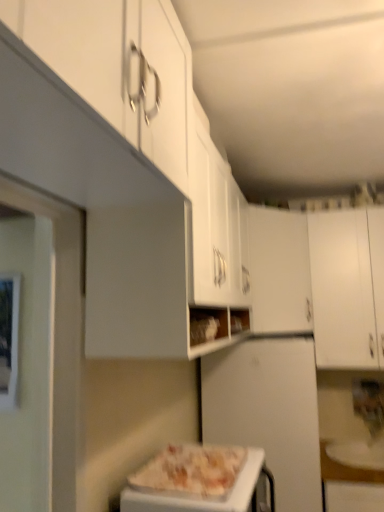
Image resolution: width=384 pixels, height=512 pixels. Describe the element at coordinates (348, 288) in the screenshot. I see `white matte cabinet at right, the first cabinetry viewed from the right` at that location.

Find the location of a particular element. This screenshot has height=512, width=384. white glossy plate at lower right is located at coordinates (346, 470).

What do you see at coordinates (346, 470) in the screenshot?
I see `white glossy plate at lower right` at bounding box center [346, 470].

You are a GUI agent. You are given a task and a screenshot of the screen. Output one action in this format:
    pyautogui.click(x=<x>, y=<y>)
    Task: Click on the white glossy pizza at center
    
    Given the screenshot: What is the action you would take?
    click(191, 471)

This screenshot has width=384, height=512. Identify the location of cabinetry below the white matte cabinet at center, arranged as the first cabinetry when viewed from the left (from the image's perspective). (348, 288).

Is white matte cabinet at center, arranged as the first cabinetry when viewed from the left, with white matte cabinet at right, the second cabinetry from the left?

white matte cabinet at center, arranged as the first cabinetry when viewed from the left, is not next to white matte cabinet at right, the second cabinetry from the left, and they're not touching.

Can white matte cabinet at right, the second cabinetry from the left, be found inside white matte cabinet at center, arranged as the first cabinetry when viewed from the left?

No, white matte cabinet at right, the second cabinetry from the left, is not surrounded by white matte cabinet at center, arranged as the first cabinetry when viewed from the left.

Is white glossy plate at lower right wider than white matte refrigerator at center?

No.

Considering the positions of points (349, 470) and (252, 341), is point (349, 470) closer to camera compared to point (252, 341)?

That is False.

Considering the relative sizes of white glossy plate at lower right and white matte refrigerator at center in the image provided, is white glossy plate at lower right smaller than white matte refrigerator at center?

Indeed, white glossy plate at lower right has a smaller size compared to white matte refrigerator at center.

Can you see white matte cabinet at center, arranged as the first cabinetry when viewed from the left, touching white glossy pizza at center?

No, white matte cabinet at center, arranged as the first cabinetry when viewed from the left, is not touching white glossy pizza at center.

From the image's perspective, is white matte cabinet at center, arranged as the first cabinetry when viewed from the left, on white glossy pizza at center?

Indeed, from the image's perspective, white matte cabinet at center, arranged as the first cabinetry when viewed from the left, is shown above white glossy pizza at center.

Is white matte cabinet at center, acting as the second cabinetry starting from the right, inside or outside of white glossy pizza at center?

white matte cabinet at center, acting as the second cabinetry starting from the right, is outside white glossy pizza at center.

How far apart are white matte cabinet at center, acting as the second cabinetry starting from the right, and white glossy pizza at center?

They are 1.13 meters apart.

Is white matte cabinet at center, acting as the second cabinetry starting from the right, inside white glossy plate at lower right?

No, white matte cabinet at center, acting as the second cabinetry starting from the right, is not inside white glossy plate at lower right.

Is point (349, 478) less distant than point (261, 320)?

Yes, it is in front of point (261, 320).

Which of these two, white glossy plate at lower right or white matte cabinet at center, arranged as the first cabinetry when viewed from the left, is wider?

Wider between the two is white glossy plate at lower right.

You are a GUI agent. You are given a task and a screenshot of the screen. Output one action in this format:
    pyautogui.click(x=<x>, y=<y>)
    Task: Click on the appliance located on the left of white matte cabinet at center, acting as the second cabinetry starting from the right
    This screenshot has width=384, height=512.
    Given the screenshot: What is the action you would take?
    pyautogui.click(x=268, y=411)

How far apart are white matte refrigerator at center and white matte cabinet at center, arranged as the first cabinetry when viewed from the left?

They are 17.62 inches apart.

Would you say white matte refrigerator at center is inside or outside white matte cabinet at center, acting as the second cabinetry starting from the right?

white matte refrigerator at center is spatially situated outside white matte cabinet at center, acting as the second cabinetry starting from the right.

From a real-world perspective, who is located lower, white matte refrigerator at center or white matte cabinet at center, acting as the second cabinetry starting from the right?

From a 3D spatial view, white matte refrigerator at center is below.

Which is behind, white glossy pizza at center or white glossy plate at lower right?

white glossy plate at lower right is further from the camera.

Which object is positioned more to the left, white glossy pizza at center or white glossy plate at lower right?

white glossy pizza at center is more to the left.

Is white glossy pizza at center in contact with white glossy plate at lower right?

No.

The image size is (384, 512). I want to click on pizza lying on the left of white glossy plate at lower right, so click(x=191, y=471).

At what (x,y) coordinates should I click in order to perform the action: click on cabinetry that is the 1st one above the white glossy pizza at center (from a real-world perspective). Please return your answer as a coordinate pair (x, y). This screenshot has width=384, height=512. Looking at the image, I should click on (348, 288).

From a real-world perspective, who is located lower, white glossy pizza at center or white matte cabinet at right, the second cabinetry from the left?

white glossy pizza at center, from a real-world perspective.

Which of these two, white glossy pizza at center or white matte cabinet at right, the second cabinetry from the left, stands taller?

With more height is white matte cabinet at right, the second cabinetry from the left.

From the image's perspective, is white glossy pizza at center located beneath white matte cabinet at right, the second cabinetry from the left?

Yes, from the image's perspective, white glossy pizza at center is below white matte cabinet at right, the second cabinetry from the left.

The width and height of the screenshot is (384, 512). In order to click on cabinetry lying above the white matte cabinet at right, the first cabinetry viewed from the right (from the image's perspective) in this screenshot , I will do `click(279, 272)`.

Locate an element on the screen. The height and width of the screenshot is (512, 384). appliance positioned vertically above the white glossy plate at lower right (from a real-world perspective) is located at coordinates (268, 411).

Considering their positions, is white matte refrigerator at center positioned closer to white matte cabinet at right, the first cabinetry viewed from the right, than white matte cabinet at center, acting as the second cabinetry starting from the right?

Among the two, white matte cabinet at center, acting as the second cabinetry starting from the right, is located nearer to white matte cabinet at right, the first cabinetry viewed from the right.

Looking at the image, which one is located closer to white glossy pizza at center, white glossy plate at lower right or white matte cabinet at right, the second cabinetry from the left?

Among the two, white glossy plate at lower right is located nearer to white glossy pizza at center.

Based on their spatial positions, is white matte cabinet at right, the second cabinetry from the left, or white glossy pizza at center further from white matte refrigerator at center?

Based on the image, white glossy pizza at center appears to be further to white matte refrigerator at center.

Estimate the real-world distances between objects in this image. Which object is closer to white glossy plate at lower right, white matte refrigerator at center or white matte cabinet at right, the first cabinetry viewed from the right?

The object closer to white glossy plate at lower right is white matte refrigerator at center.

From the picture: When comparing their distances from white matte refrigerator at center, does white glossy pizza at center or white glossy plate at lower right seem further?

white glossy pizza at center.

Considering their positions, is white glossy pizza at center positioned further to white matte refrigerator at center than white matte cabinet at center, acting as the second cabinetry starting from the right?

Based on the image, white glossy pizza at center appears to be further to white matte refrigerator at center.

From the picture: When comparing their distances from white glossy plate at lower right, does white matte cabinet at center, acting as the second cabinetry starting from the right, or white matte cabinet at right, the first cabinetry viewed from the right, seem closer?

white matte cabinet at right, the first cabinetry viewed from the right, lies closer to white glossy plate at lower right than the other object.

Considering their positions, is white glossy pizza at center positioned closer to white matte cabinet at right, the first cabinetry viewed from the right, than white matte cabinet at center, acting as the second cabinetry starting from the right?

The object closer to white matte cabinet at right, the first cabinetry viewed from the right, is white matte cabinet at center, acting as the second cabinetry starting from the right.

What are the coordinates of `counter top positioned between white glossy pizza at center and white matte cabinet at right, the second cabinetry from the left, from near to far` in the screenshot? It's located at (346, 470).

You are a GUI agent. You are given a task and a screenshot of the screen. Output one action in this format:
    pyautogui.click(x=<x>, y=<y>)
    Task: Click on the cabinetry between white matte cabinet at center, arranged as the first cabinetry when viewed from the left, and white glossy plate at lower right, in the vertical direction
    
    Given the screenshot: What is the action you would take?
    pyautogui.click(x=348, y=288)

Identify the location of counter top between white glossy pizza at center and white matte cabinet at center, arranged as the first cabinetry when viewed from the left, from front to back. The height and width of the screenshot is (512, 384). (346, 470).

This screenshot has height=512, width=384. In order to click on cabinetry positioned between white glossy pizza at center and white matte cabinet at right, the first cabinetry viewed from the right, from near to far in this screenshot , I will do `click(279, 272)`.